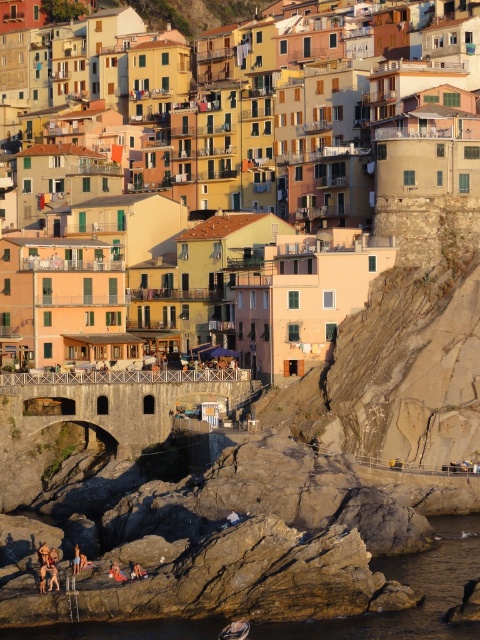
Consider the image. You are a tourist standing on the cliff overlooking the matte yellow building at center and the brown leather jacket at lower center. Which object appears taller from your viewpoint?

The matte yellow building at center is taller than the brown leather jacket at lower center, so it would appear taller from your viewpoint.

You are a tourist standing at the edge of the rocky coastline in this Cinque Terre scene. You want to take a photo of both the translucent water at lower center and the metallic gray boat at lower center. How far apart are these two objects from each other?

The translucent water at lower center is 11.31 meters away from the metallic gray boat at lower center, so they are 11.31 meters apart from each other.

You are a photographer planning to capture the entire scene of the translucent water at lower center and the metallic gray boat at lower center in one shot. Considering their sizes, which object should you focus on to ensure both are clearly visible in your photo?

The translucent water at lower center is bigger than the metallic gray boat at lower center, so focusing on the larger area of the translucent water at lower center would help ensure both objects are clearly visible in the photo.